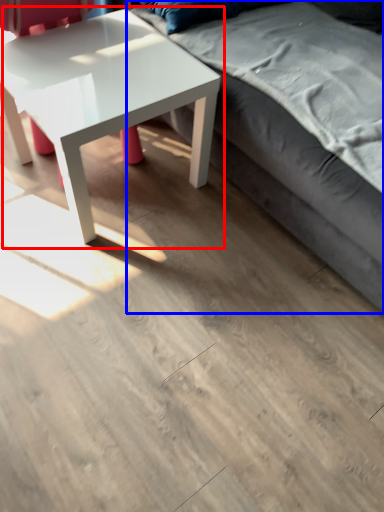
Question: Which object appears closest to the camera in this image, coffee table (highlighted by a red box) or studio couch (highlighted by a blue box)?

Choices:
 (A) coffee table
 (B) studio couch

Answer: (B)